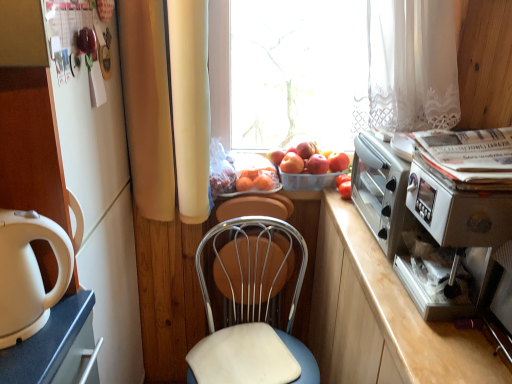
Question: Is orange matte at center facing away from metallic silver toaster oven at right?

Choices:
 (A) no
 (B) yes

Answer: (A)

Question: Does orange matte at center have a greater width compared to metallic silver toaster oven at right?

Choices:
 (A) no
 (B) yes

Answer: (A)

Question: Does orange matte at center have a lesser height compared to metallic silver toaster oven at right?

Choices:
 (A) no
 (B) yes

Answer: (B)

Question: Considering the relative positions of orange matte at center and metallic silver toaster oven at right in the image provided, is orange matte at center to the left of metallic silver toaster oven at right from the viewer's perspective?

Choices:
 (A) yes
 (B) no

Answer: (A)

Question: Does orange matte at center have a lesser width compared to metallic silver toaster oven at right?

Choices:
 (A) yes
 (B) no

Answer: (A)

Question: From the image's perspective, is red matte apple at upper right, placed as the 1th apple when sorted from right to left, above or below red matte apple at center, the second apple when ordered from left to right?

Choices:
 (A) below
 (B) above

Answer: (A)

Question: Considering the relative positions of red matte apple at upper right, which is counted as the 4th apple, starting from the left, and red matte apple at center, the second apple when ordered from left to right, in the image provided, is red matte apple at upper right, which is counted as the 4th apple, starting from the left, to the left or to the right of red matte apple at center, the second apple when ordered from left to right,?

Choices:
 (A) left
 (B) right

Answer: (B)

Question: Which is correct: red matte apple at upper right, placed as the 1th apple when sorted from right to left, is inside red matte apple at center, the second apple when ordered from left to right, or outside of it?

Choices:
 (A) outside
 (B) inside

Answer: (A)

Question: From a real-world perspective, is red matte apple at upper right, placed as the 1th apple when sorted from right to left, physically located above or below red matte apple at center, the second apple when ordered from left to right?

Choices:
 (A) below
 (B) above

Answer: (A)

Question: Is point (106, 367) closer or farther from the camera than point (286, 170)?

Choices:
 (A) closer
 (B) farther

Answer: (A)

Question: In terms of size, does white glossy cabinet at left appear bigger or smaller than smooth peach at center, which is the 4th apple in right-to-left order?

Choices:
 (A) big
 (B) small

Answer: (A)

Question: Visually, is white glossy cabinet at left positioned to the left or to the right of smooth peach at center, which is the 4th apple in right-to-left order?

Choices:
 (A) left
 (B) right

Answer: (A)

Question: From their relative heights in the image, would you say white glossy cabinet at left is taller or shorter than smooth peach at center, acting as the 1th apple starting from the left?

Choices:
 (A) tall
 (B) short

Answer: (A)

Question: Relative to metallic blue chair at center, is orange matte at center in front or behind?

Choices:
 (A) behind
 (B) front

Answer: (A)

Question: In terms of size, does orange matte at center appear bigger or smaller than metallic blue chair at center?

Choices:
 (A) small
 (B) big

Answer: (A)